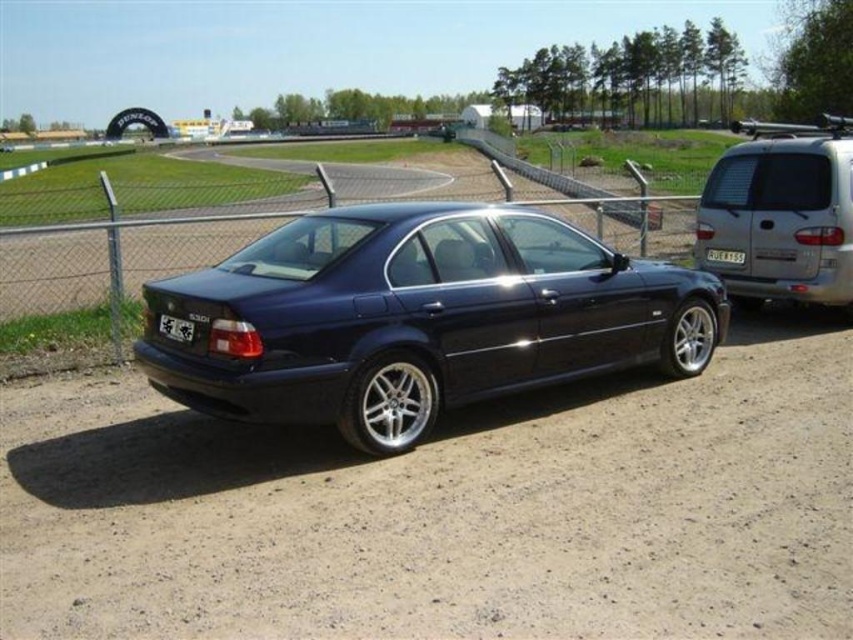
Between satin silver van at right and black plastic license plate at center, which one has less height?

black plastic license plate at center is shorter.

The height and width of the screenshot is (640, 853). What do you see at coordinates (780, 218) in the screenshot? I see `satin silver van at right` at bounding box center [780, 218].

Find the location of `satin silver van at right`. satin silver van at right is located at coordinates (780, 218).

Does glossy dark blue sedan at center appear on the left side of metallic chain-link fence at center?

In fact, glossy dark blue sedan at center is to the right of metallic chain-link fence at center.

What do you see at coordinates (416, 317) in the screenshot?
I see `glossy dark blue sedan at center` at bounding box center [416, 317].

Does point (260, 253) lie in front of point (665, 211)?

Yes.

Find the location of a particular element. The image size is (853, 640). glossy dark blue sedan at center is located at coordinates (416, 317).

What do you see at coordinates (416, 317) in the screenshot?
I see `glossy dark blue sedan at center` at bounding box center [416, 317].

Can you confirm if glossy dark blue sedan at center is bigger than black plastic license plate at rear?

Indeed, glossy dark blue sedan at center has a larger size compared to black plastic license plate at rear.

Between point (433, 253) and point (160, 324), which one is positioned behind?

Positioned behind is point (433, 253).

Find the location of a particular element. glossy dark blue sedan at center is located at coordinates click(x=416, y=317).